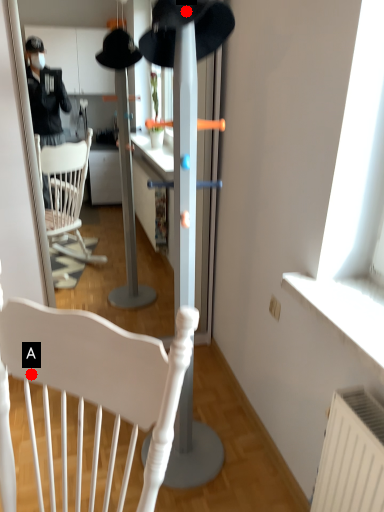
Question: Two points are circled on the image, labeled by A and B beside each circle. Which point is closer to the camera?

Choices:
 (A) A is closer
 (B) B is closer

Answer: (A)